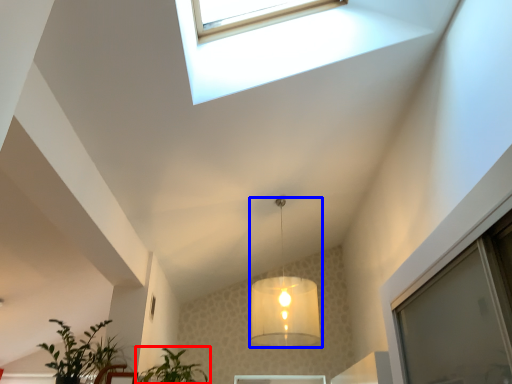
Question: Which point is further to the camera, houseplant (highlighted by a red box) or lamp (highlighted by a blue box)?

Choices:
 (A) houseplant
 (B) lamp

Answer: (B)